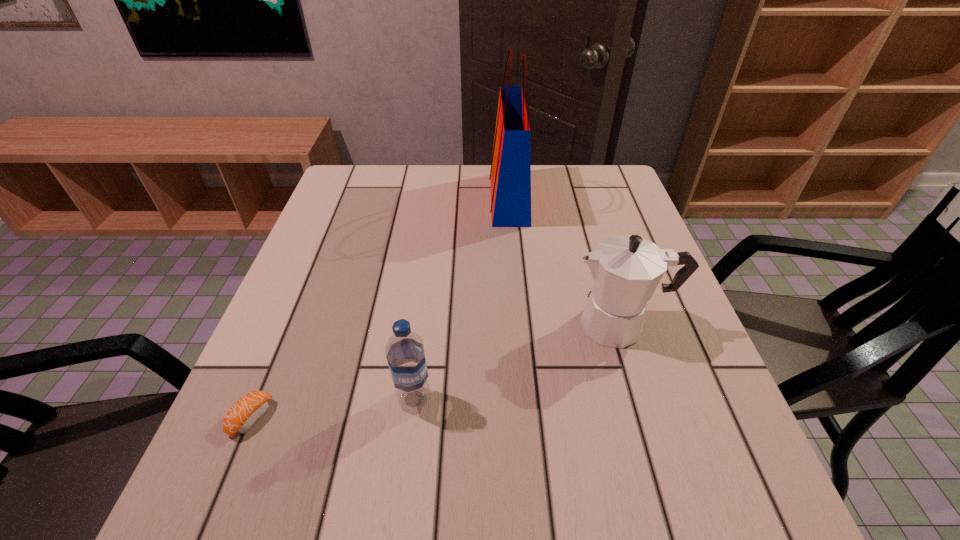
At what (x,y) coordinates should I click in order to perform the action: click on free spot that satisfies the following two spatial constraints: 1. on the handle side of the tallest object; 2. on the label of the third tallest object. Please return your answer as a coordinate pair (x, y). Looking at the image, I should click on (526, 399).

Locate an element on the screen. This screenshot has height=540, width=960. free region that satisfies the following two spatial constraints: 1. at the spout of the second farthest object; 2. on the label of the second shortest object is located at coordinates (643, 399).

Locate an element on the screen. The image size is (960, 540). free spot that satisfies the following two spatial constraints: 1. at the spout of the coffeepot; 2. on the label of the third object from right to left is located at coordinates (643, 399).

Find the location of `blank space that satisfies the following two spatial constraints: 1. at the spout of the coffeepot; 2. on the label of the water bottle`. blank space that satisfies the following two spatial constraints: 1. at the spout of the coffeepot; 2. on the label of the water bottle is located at coordinates (643, 399).